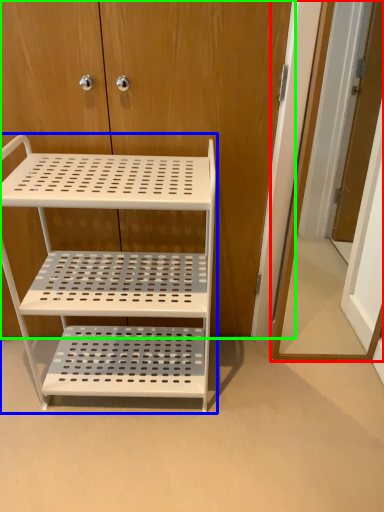
Question: Which object is the farthest from door (highlighted by a red box)? Choose among these: shelf (highlighted by a blue box) or dresser (highlighted by a green box).

Choices:
 (A) shelf
 (B) dresser

Answer: (A)